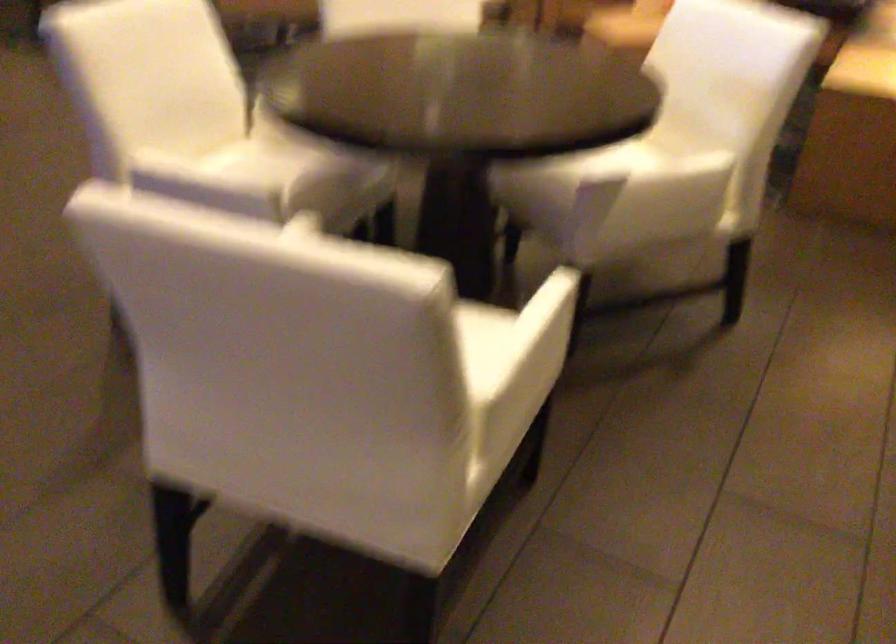
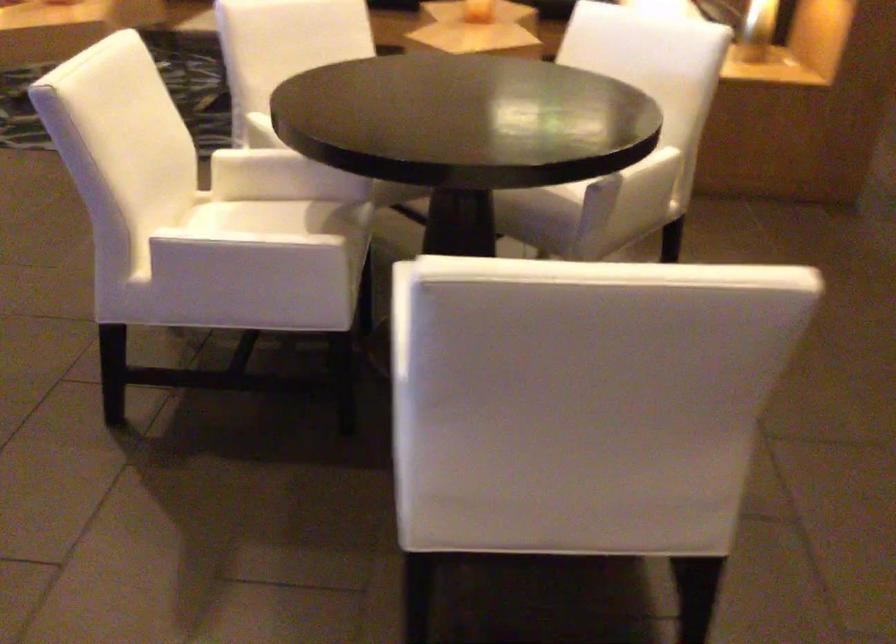
Question: Which direction would the cameraman need to move to produce the second image? Reply with the corresponding letter.

Choices:
 (A) Left
 (B) Right
 (C) Forward
 (D) Backward

Answer: (A)